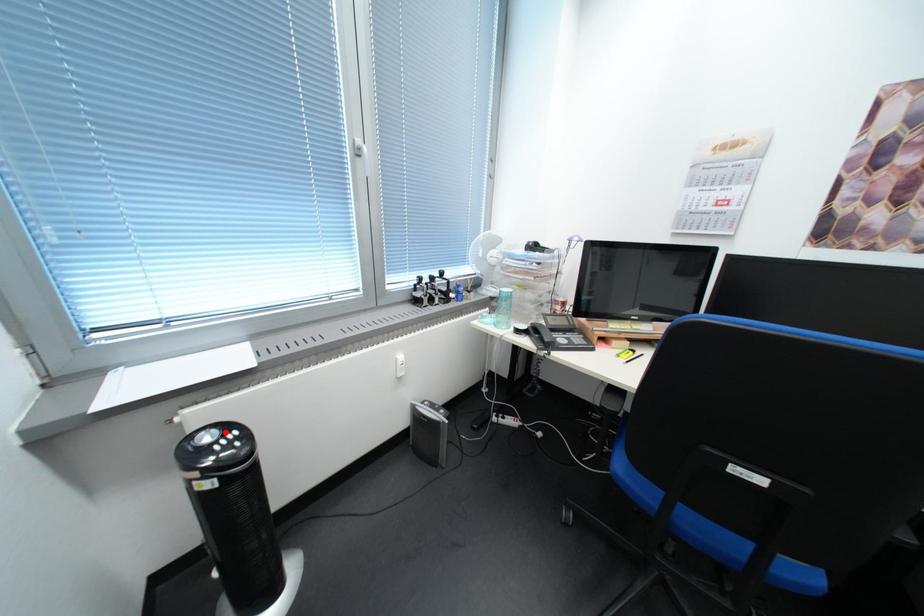
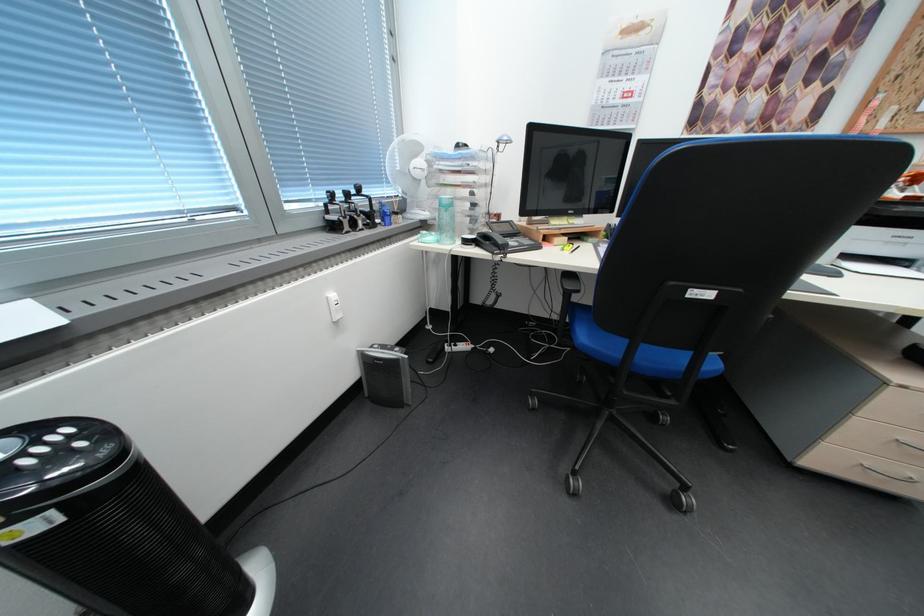
Question: I am providing you with two images of the same scene from different viewpoints. A red point is marked on the first image. Is the red point's position out of view in image 2?

Choices:
 (A) Yes
 (B) No

Answer: (B)